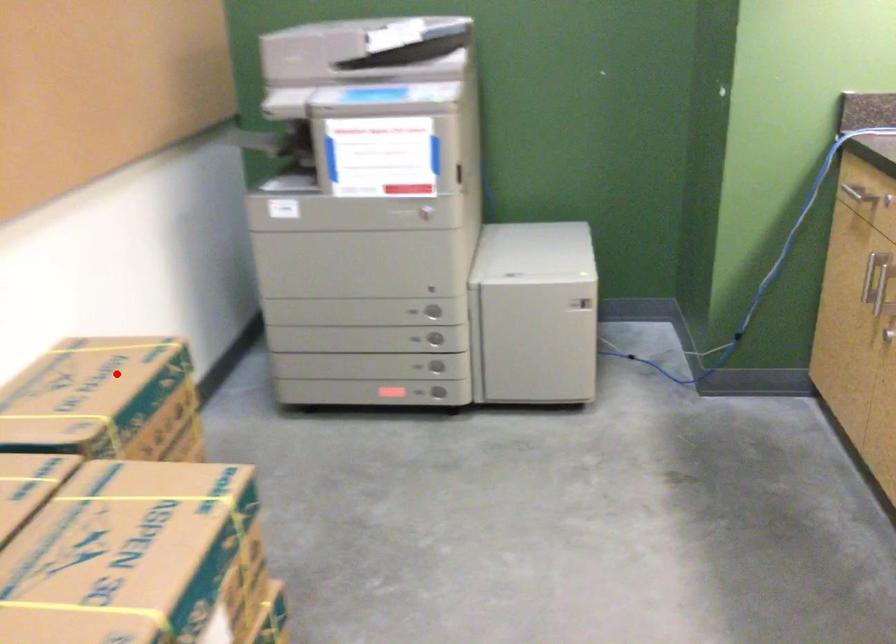
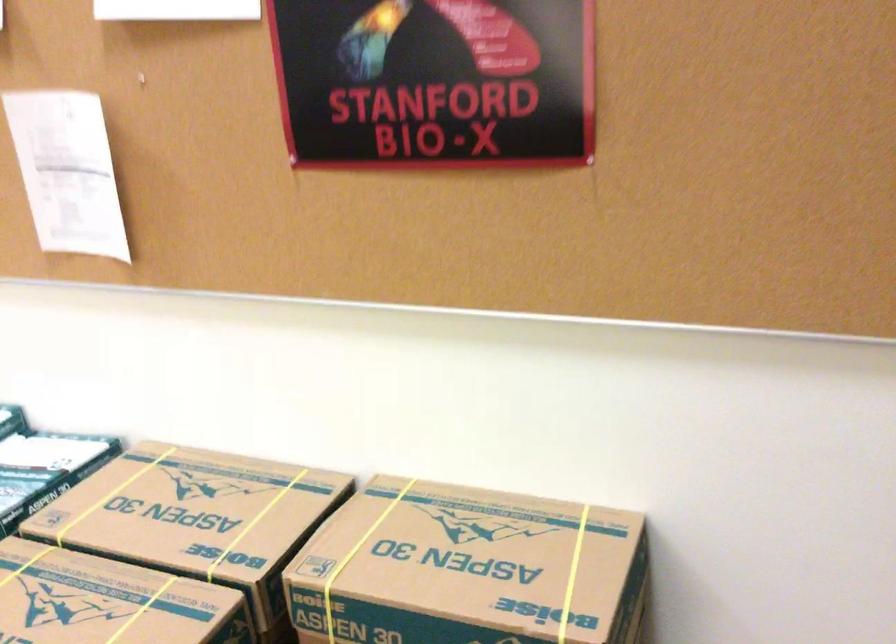
Where in the second image is the point corresponding to the highlighted location from the first image?

(468, 569)